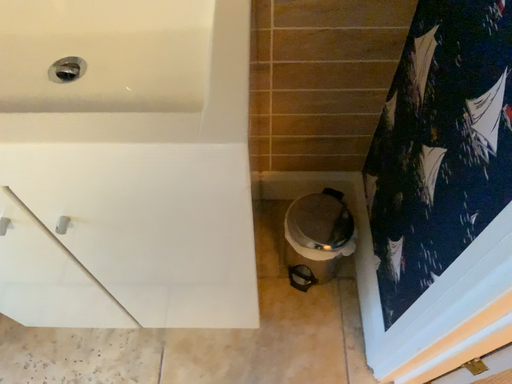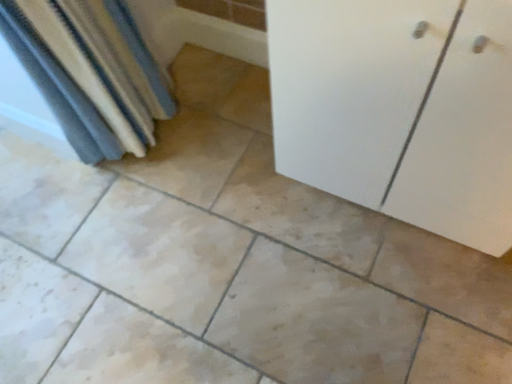
Question: How did the camera likely rotate when shooting the video?

Choices:
 (A) rotated right
 (B) rotated left

Answer: (B)